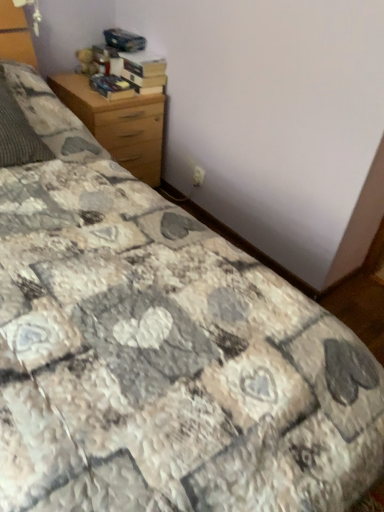
Where is `empty space that is ontop of wooden chest of drawers at upper left`? empty space that is ontop of wooden chest of drawers at upper left is located at coordinates (94, 86).